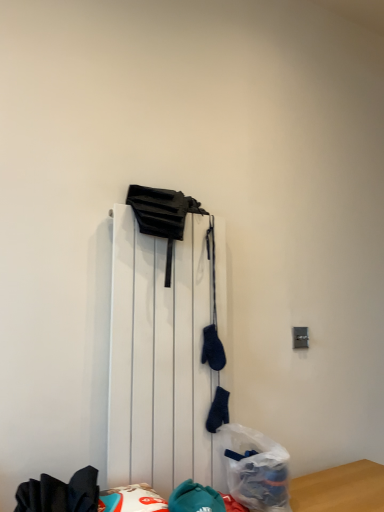
Question: From the image's perspective, is translucent plastic bag at lower center beneath white matte radiator at center?

Choices:
 (A) no
 (B) yes

Answer: (B)

Question: Does translucent plastic bag at lower center have a lesser width compared to white matte radiator at center?

Choices:
 (A) yes
 (B) no

Answer: (B)

Question: From a real-world perspective, is translucent plastic bag at lower center located beneath white matte radiator at center?

Choices:
 (A) no
 (B) yes

Answer: (B)

Question: Is translucent plastic bag at lower center positioned in front of white matte radiator at center?

Choices:
 (A) no
 (B) yes

Answer: (A)

Question: Can you confirm if translucent plastic bag at lower center is smaller than white matte radiator at center?

Choices:
 (A) no
 (B) yes

Answer: (B)

Question: Is translucent plastic bag at lower center outside of white matte radiator at center?

Choices:
 (A) no
 (B) yes

Answer: (B)

Question: From a real-world perspective, is white matte radiator at center on top of translucent plastic bag at lower center?

Choices:
 (A) yes
 (B) no

Answer: (A)

Question: Is white matte radiator at center shorter than translucent plastic bag at lower center?

Choices:
 (A) yes
 (B) no

Answer: (B)

Question: Considering the relative sizes of white matte radiator at center and translucent plastic bag at lower center in the image provided, is white matte radiator at center smaller than translucent plastic bag at lower center?

Choices:
 (A) yes
 (B) no

Answer: (B)

Question: From a real-world perspective, is white matte radiator at center under translucent plastic bag at lower center?

Choices:
 (A) yes
 (B) no

Answer: (B)

Question: Can we say white matte radiator at center lies outside translucent plastic bag at lower center?

Choices:
 (A) yes
 (B) no

Answer: (A)

Question: Is the depth of white matte radiator at center greater than that of translucent plastic bag at lower center?

Choices:
 (A) yes
 (B) no

Answer: (B)

Question: From the image's perspective, is translucent plastic bag at lower center located above or below white matte radiator at center?

Choices:
 (A) above
 (B) below

Answer: (B)